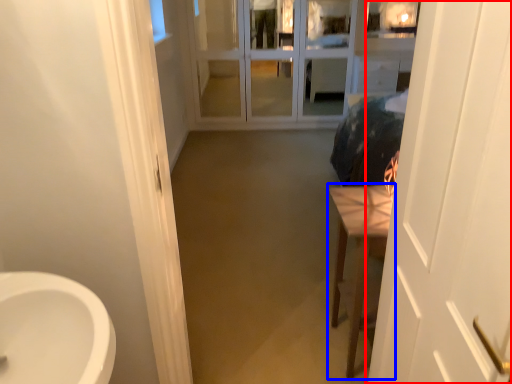
Question: Which of the following is the closest to the observer, door (highlighted by a red box) or furniture (highlighted by a blue box)?

Choices:
 (A) door
 (B) furniture

Answer: (A)